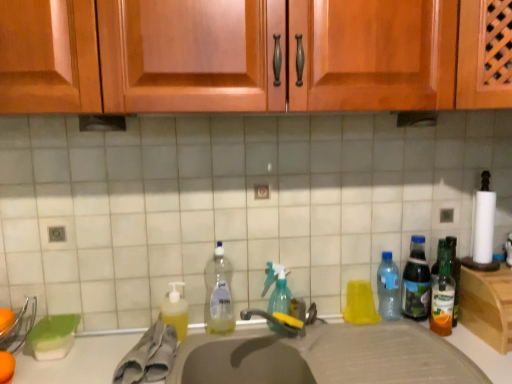
Question: Looking at the image, does gray fabric towel at sink seem bigger or smaller compared to green glass bottle at right?

Choices:
 (A) big
 (B) small

Answer: (B)

Question: Looking at their shapes, would you say gray fabric towel at sink is wider or thinner than green glass bottle at right?

Choices:
 (A) thin
 (B) wide

Answer: (A)

Question: Which is nearer to the green glass bottle at right?

Choices:
 (A) clear plastic bottle at center, placed as the 5th bottle when sorted from right to left
 (B) gray fabric towel at sink
 (C) translucent plastic bottle at right, the fourth bottle viewed from the left
 (D) translucent plastic bottle at right, which is the first bottle from right to left
 (E) white tile at center

Answer: (D)

Question: Estimate the real-world distances between objects in this image. Which object is closer to the gray fabric towel at sink?

Choices:
 (A) translucent plastic spray bottle at center, the 2th bottle viewed from the left
 (B) white tile at center
 (C) transparent plastic bottle at right, which is the third bottle from left to right
 (D) translucent plastic bottle at right, which is the first bottle from right to left
 (E) gray matte sink at center

Answer: (E)